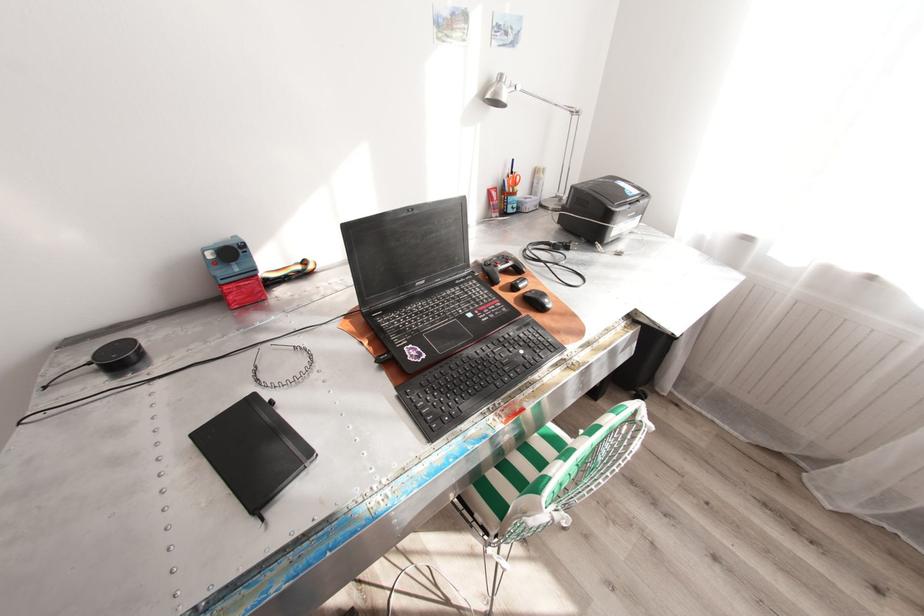
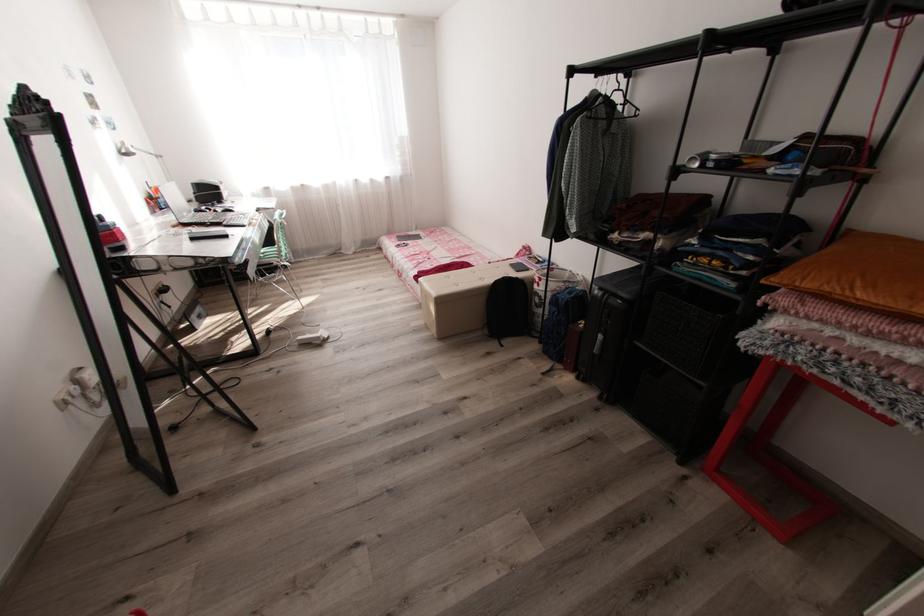
Locate, in the second image, the point that corresponds to the point at 492,95 in the first image.

(129, 151)